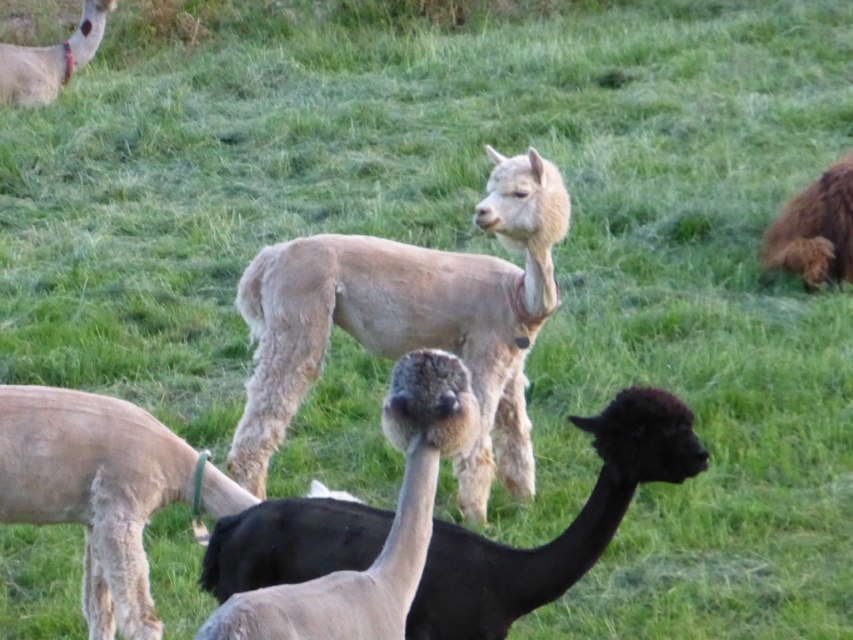
Can you confirm if light beige wool alpaca at center is thinner than light beige wool alpaca at upper left?

No, light beige wool alpaca at center is not thinner than light beige wool alpaca at upper left.

Between light beige wool alpaca at center and light beige wool alpaca at upper left, which one has less height?

light beige wool alpaca at upper left is shorter.

Between point (422, 284) and point (33, 97), which one is positioned behind?

The point (33, 97) is more distant.

Locate an element on the screen. light beige wool alpaca at center is located at coordinates (410, 321).

Can you confirm if light beige wool alpaca at center is thinner than black woolly alpaca at center?

In fact, light beige wool alpaca at center might be wider than black woolly alpaca at center.

Does light beige wool alpaca at center appear on the left side of black woolly alpaca at center?

In fact, light beige wool alpaca at center is to the right of black woolly alpaca at center.

Which is in front, point (527, 433) or point (514, 584)?

Positioned in front is point (514, 584).

The height and width of the screenshot is (640, 853). I want to click on light beige wool alpaca at center, so click(x=410, y=321).

Is black woolly alpaca at center positioned behind light beige wool alpaca at upper left?

No.

Which is more to the right, black woolly alpaca at center or light beige wool alpaca at upper left?

black woolly alpaca at center is more to the right.

What do you see at coordinates (558, 534) in the screenshot?
I see `black woolly alpaca at center` at bounding box center [558, 534].

Where is `black woolly alpaca at center`? The image size is (853, 640). black woolly alpaca at center is located at coordinates (558, 534).